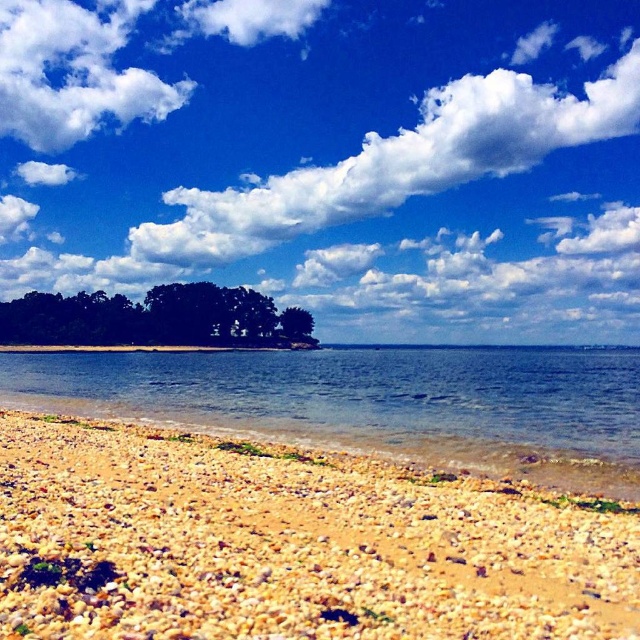
You are standing on the pebble beach in the foreground of the coastal scene. You notice a point marked at coordinates (291, 544). What type of terrain would you find there?

At point (291, 544), you would find brown gravelly sand at lower left.

You are a painter standing on the beach and want to capture the scene. Which object, the white fluffy cloud at upper center or the green matte tree at center, would you need to paint first if you are following the rule of painting from the largest to the smallest objects?

The white fluffy cloud at upper center should be painted first because it has a larger size compared to the green matte tree at center.